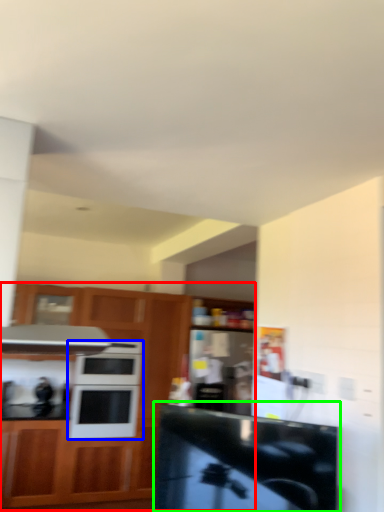
Question: Which object is positioned closest to cabinetry (highlighted by a red box)? Select from microwave oven (highlighted by a blue box) and counter top (highlighted by a green box).

Choices:
 (A) microwave oven
 (B) counter top

Answer: (A)